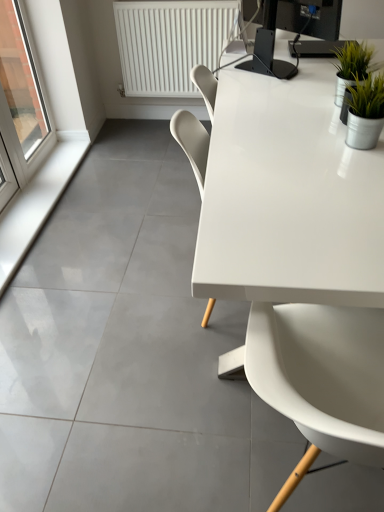
Question: From the image's perspective, is white smooth window sill at lower left under transparent glass window at left?

Choices:
 (A) no
 (B) yes

Answer: (B)

Question: From a real-world perspective, is white smooth window sill at lower left under transparent glass window at left?

Choices:
 (A) no
 (B) yes

Answer: (B)

Question: Is white smooth window sill at lower left next to transparent glass window at left and touching it?

Choices:
 (A) no
 (B) yes

Answer: (A)

Question: Is white smooth window sill at lower left oriented towards transparent glass window at left?

Choices:
 (A) no
 (B) yes

Answer: (A)

Question: Is white smooth window sill at lower left facing away from transparent glass window at left?

Choices:
 (A) no
 (B) yes

Answer: (A)

Question: Does white smooth window sill at lower left have a smaller size compared to transparent glass window at left?

Choices:
 (A) no
 (B) yes

Answer: (B)

Question: Does white plastic radiator at upper center have a lesser height compared to black glossy monitor at upper right?

Choices:
 (A) no
 (B) yes

Answer: (A)

Question: Is white plastic radiator at upper center further to the viewer compared to black glossy monitor at upper right?

Choices:
 (A) no
 (B) yes

Answer: (B)

Question: Is white plastic radiator at upper center taller than black glossy monitor at upper right?

Choices:
 (A) no
 (B) yes

Answer: (B)

Question: Can you confirm if white plastic radiator at upper center is smaller than black glossy monitor at upper right?

Choices:
 (A) yes
 (B) no

Answer: (B)

Question: From a real-world perspective, is white plastic radiator at upper center positioned over black glossy monitor at upper right based on gravity?

Choices:
 (A) yes
 (B) no

Answer: (B)

Question: Considering the relative sizes of white plastic radiator at upper center and black glossy monitor at upper right in the image provided, is white plastic radiator at upper center thinner than black glossy monitor at upper right?

Choices:
 (A) yes
 (B) no

Answer: (A)

Question: Is transparent glass window at left not within white smooth window sill at lower left?

Choices:
 (A) no
 (B) yes

Answer: (B)